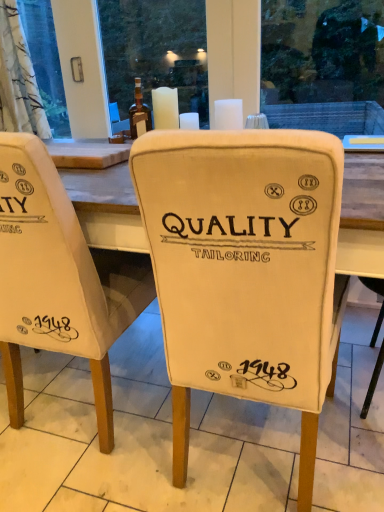
Question: Is translucent glass bottle at center to the right of white wax candle at upper center, the first candle from the left, from the viewer's perspective?

Choices:
 (A) no
 (B) yes

Answer: (A)

Question: From a real-world perspective, is translucent glass bottle at center located beneath white wax candle at upper center, arranged as the 2th candle when viewed from the right?

Choices:
 (A) yes
 (B) no

Answer: (B)

Question: Can you confirm if translucent glass bottle at center is smaller than white wax candle at upper center, arranged as the 2th candle when viewed from the right?

Choices:
 (A) no
 (B) yes

Answer: (A)

Question: Is there a large distance between translucent glass bottle at center and white wax candle at upper center, arranged as the 2th candle when viewed from the right?

Choices:
 (A) yes
 (B) no

Answer: (B)

Question: Can you confirm if translucent glass bottle at center is wider than white wax candle at upper center, the first candle from the left?

Choices:
 (A) yes
 (B) no

Answer: (A)

Question: Considering the relative sizes of translucent glass bottle at center and white wax candle at upper center, the first candle from the left, in the image provided, is translucent glass bottle at center taller than white wax candle at upper center, the first candle from the left,?

Choices:
 (A) yes
 (B) no

Answer: (A)

Question: Considering the relative sizes of white matte candle at upper center, arranged as the first candle when viewed from the right, and white fabric chair at center, which appears as the 2th chair when viewed from the right, in the image provided, is white matte candle at upper center, arranged as the first candle when viewed from the right, thinner than white fabric chair at center, which appears as the 2th chair when viewed from the right,?

Choices:
 (A) yes
 (B) no

Answer: (A)

Question: Does white matte candle at upper center, the 2th candle positioned from the left, have a smaller size compared to white fabric chair at center, the 1th chair positioned from the left?

Choices:
 (A) yes
 (B) no

Answer: (A)

Question: Does white matte candle at upper center, arranged as the first candle when viewed from the right, have a greater width compared to white fabric chair at center, the 1th chair positioned from the left?

Choices:
 (A) no
 (B) yes

Answer: (A)

Question: Is white matte candle at upper center, the 2th candle positioned from the left, at the left side of white fabric chair at center, which appears as the 2th chair when viewed from the right?

Choices:
 (A) yes
 (B) no

Answer: (B)

Question: Is there a large distance between white matte candle at upper center, the 2th candle positioned from the left, and white fabric chair at center, the 1th chair positioned from the left?

Choices:
 (A) no
 (B) yes

Answer: (A)

Question: Is white matte candle at upper center, the 2th candle positioned from the left, taller than white fabric chair at center, which appears as the 2th chair when viewed from the right?

Choices:
 (A) no
 (B) yes

Answer: (A)

Question: From the image's perspective, would you say white wax candle at upper center, the first candle from the left, is shown under translucent glass bottle at center?

Choices:
 (A) no
 (B) yes

Answer: (B)